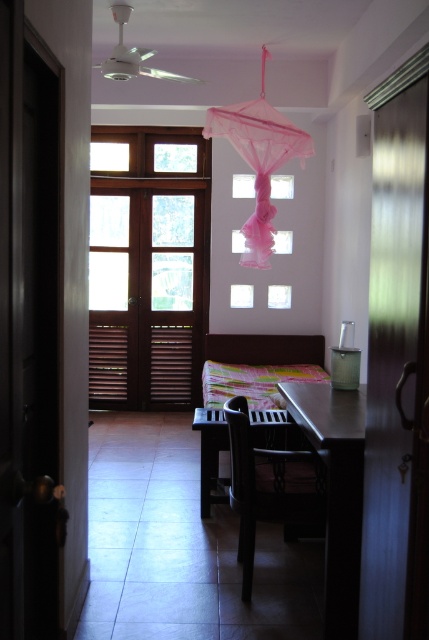
Question: Estimate the real-world distances between objects in this image. Which object is closer to the metallic dark brown table at center?

Choices:
 (A) black matte chair at center
 (B) dark brown wooden table at center
 (C) pink tulle umbrella at upper center

Answer: (A)

Question: Which object is closer to the camera taking this photo?

Choices:
 (A) pink tulle umbrella at upper center
 (B) metallic dark brown table at center
 (C) dark brown wooden table at center
 (D) black matte chair at center

Answer: (B)

Question: Does black matte chair at center come in front of dark brown wooden table at center?

Choices:
 (A) yes
 (B) no

Answer: (A)

Question: Does black matte chair at center appear on the right side of dark brown wooden table at center?

Choices:
 (A) no
 (B) yes

Answer: (B)

Question: Considering the real-world distances, which object is closest to the black matte chair at center?

Choices:
 (A) pink tulle umbrella at upper center
 (B) dark brown wooden table at center

Answer: (B)

Question: Can you confirm if metallic dark brown table at center is smaller than pink tulle umbrella at upper center?

Choices:
 (A) yes
 (B) no

Answer: (A)